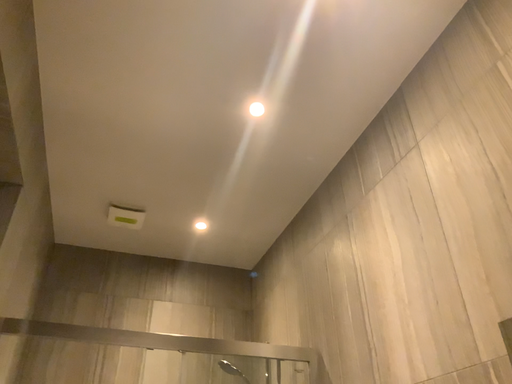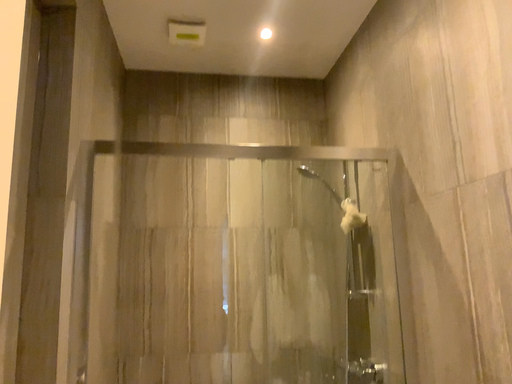
Question: How did the camera likely rotate when shooting the video?

Choices:
 (A) rotated upward
 (B) rotated downward

Answer: (B)